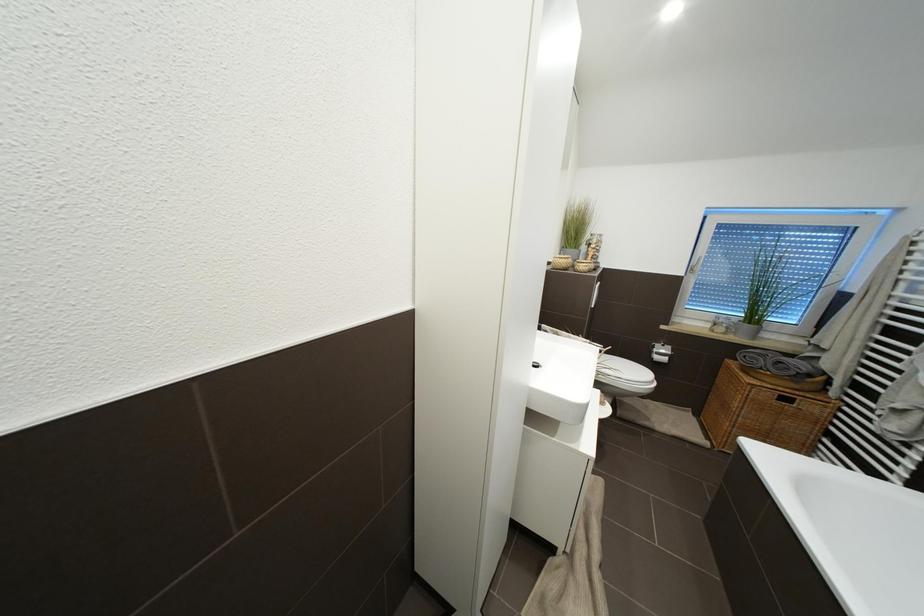
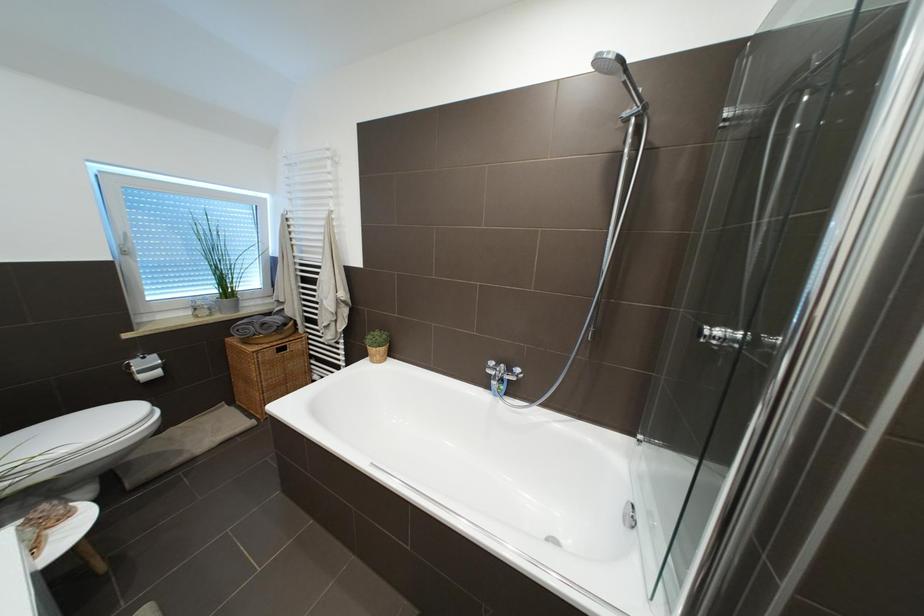
First-person continuous shooting, in which direction is the camera rotating?

The camera rotated toward right-down.